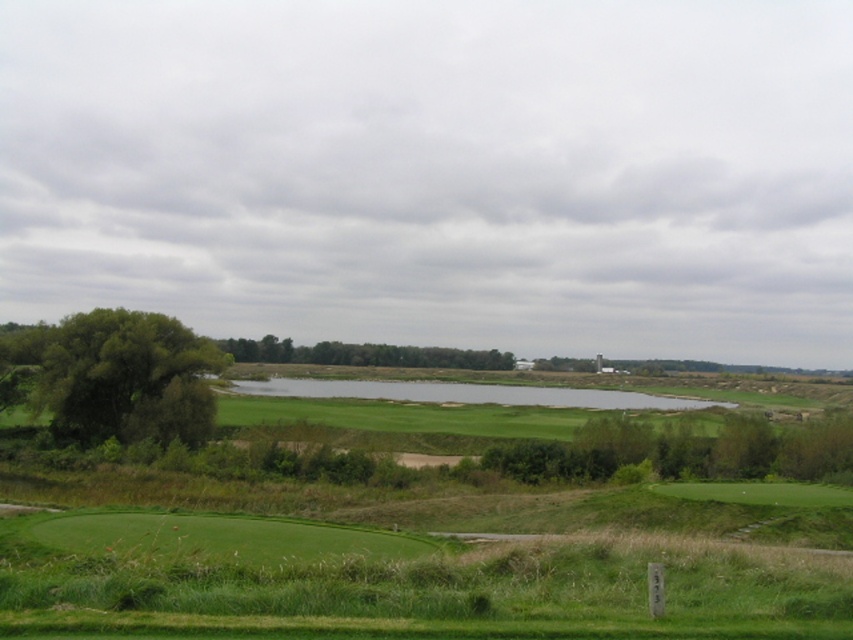
Does clear water at center appear on the left side of green leafy trees at center?

Incorrect, clear water at center is not on the left side of green leafy trees at center.

Does clear water at center come behind green leafy trees at center?

No.

Does point (424, 385) lie in front of point (486, 362)?

Yes.

What are the coordinates of `clear water at center` in the screenshot? It's located at (468, 394).

Is green leafy tree at left thinner than clear water at center?

Correct, green leafy tree at left's width is less than clear water at center's.

Between green leafy tree at left and clear water at center, which one appears on the right side from the viewer's perspective?

clear water at center

Between point (108, 320) and point (519, 403), which one is positioned in front?

Positioned in front is point (108, 320).

Identify the location of green leafy tree at left. (126, 378).

Does green leafy tree at left appear on the left side of green leafy trees at center?

Indeed, green leafy tree at left is positioned on the left side of green leafy trees at center.

Which is in front, point (68, 353) or point (403, 348)?

Point (68, 353)

Locate an element on the screen. The height and width of the screenshot is (640, 853). green leafy tree at left is located at coordinates (126, 378).